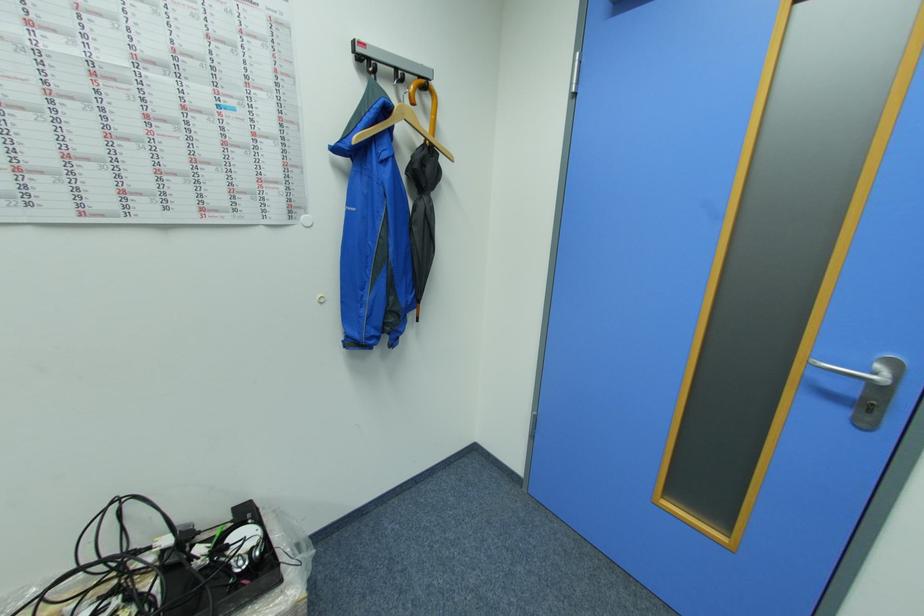
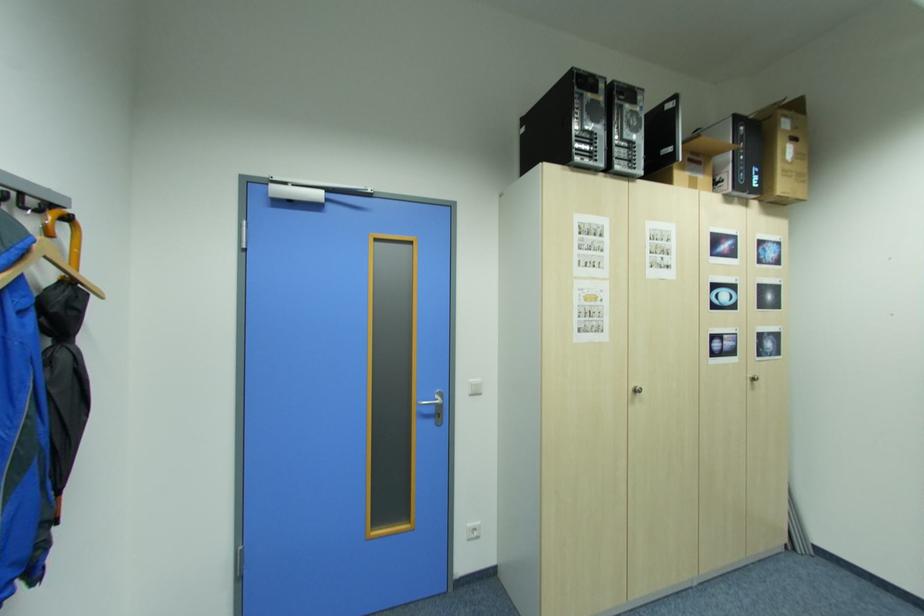
Locate, in the second image, the point that corresponds to (432,87) in the first image.

(76, 219)